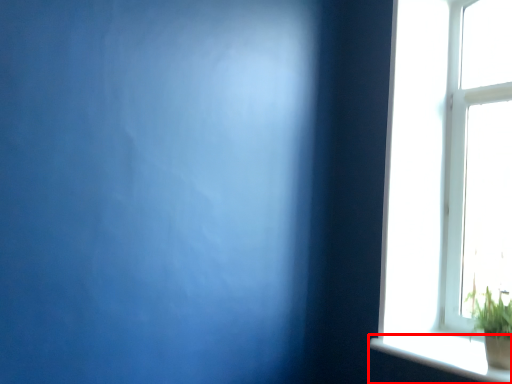
Question: In this image, where is window sill (annotated by the red box) located relative to houseplant?

Choices:
 (A) left
 (B) right

Answer: (A)